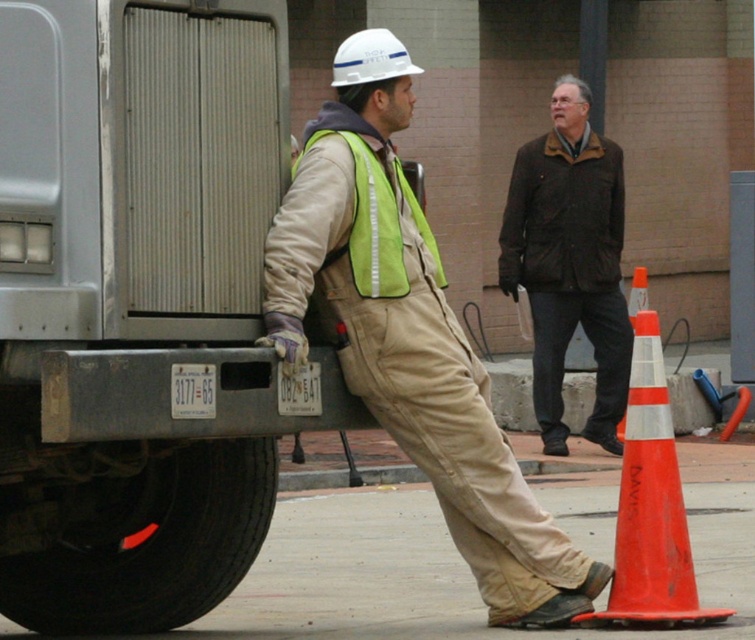
Question: Is brushed metal trailer truck at left positioned at the back of orange plastic traffic cone at lower right?

Choices:
 (A) yes
 (B) no

Answer: (B)

Question: Among these objects, which one is farthest from the camera?

Choices:
 (A) orange plastic traffic cone at lower right
 (B) black rubber tire at lower left
 (C) brown woolen jacket at upper center

Answer: (C)

Question: Which point is closer to the camera?

Choices:
 (A) brushed metal trailer truck at left
 (B) matte khaki overalls at center

Answer: (A)

Question: Does matte khaki overalls at center have a larger size compared to brown woolen jacket at upper center?

Choices:
 (A) yes
 (B) no

Answer: (A)

Question: Estimate the real-world distances between objects in this image. Which object is closer to the black rubber tire at lower left?

Choices:
 (A) green reflective safety vest at center
 (B) brown woolen jacket at upper center
 (C) orange plastic traffic cone at lower right

Answer: (A)

Question: Can you confirm if matte khaki overalls at center is bigger than green reflective safety vest at center?

Choices:
 (A) yes
 (B) no

Answer: (A)